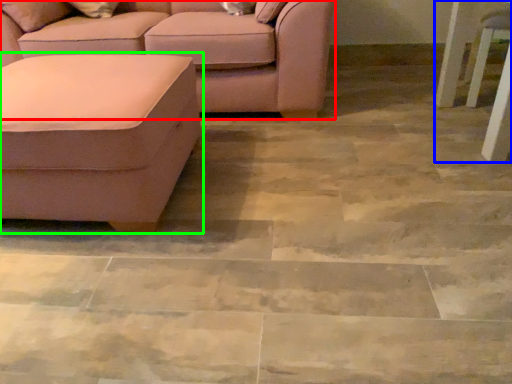
Question: Which object is positioned farthest from studio couch (highlighted by a red box)? Select from side table (highlighted by a blue box) and studio couch (highlighted by a green box).

Choices:
 (A) side table
 (B) studio couch

Answer: (A)